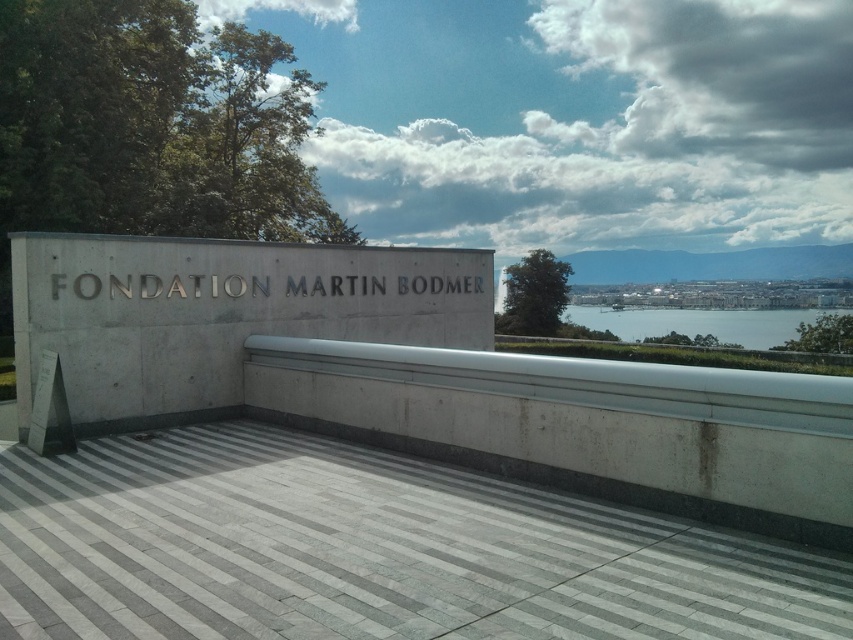
Is white concrete sign at center closer to the viewer compared to clear blue water at center?

That is True.

Can you confirm if white concrete sign at center is smaller than clear blue water at center?

Yes.

The width and height of the screenshot is (853, 640). What do you see at coordinates (218, 314) in the screenshot?
I see `white concrete sign at center` at bounding box center [218, 314].

In order to click on white concrete sign at center in this screenshot , I will do `click(218, 314)`.